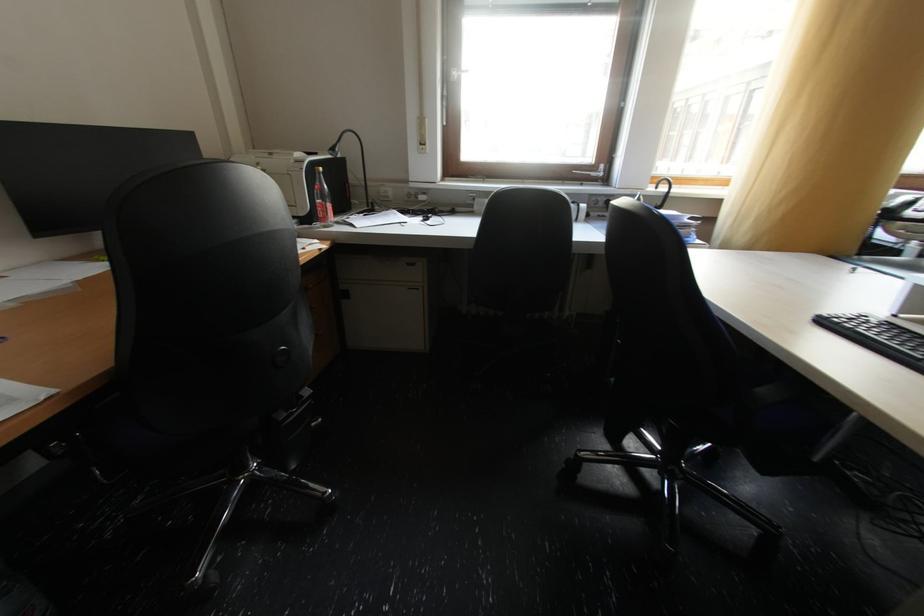
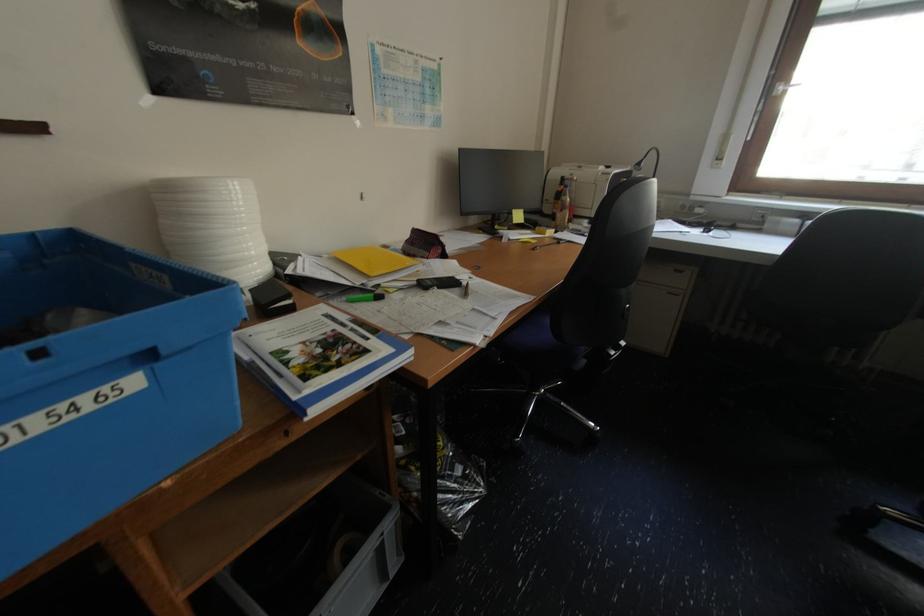
The point at (460, 71) is marked in the first image. Where is the corresponding point in the second image?

(786, 84)